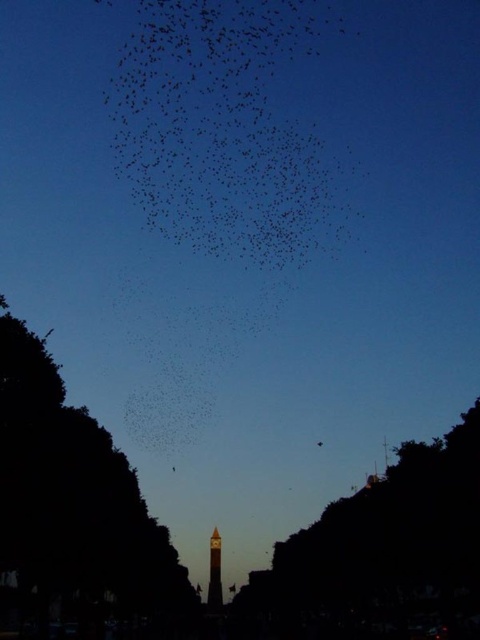
You are standing at the center of the image and want to walk towards the dark green leafy tree at left. Which direction should you face to head directly towards it?

The dark green leafy tree at left is located at point (75, 516), which means it is positioned to the left and slightly lower from the center. To head directly towards it, you should face towards the left and slightly downward direction.

You are standing at the base of the tower in the image and notice two points in the sky. The first point is at coordinates point (x=39, y=628) and the second is at point (x=316, y=444). Which point is closer to you?

Point (x=39, y=628) is in front of point (x=316, y=444), so it is closer to you.